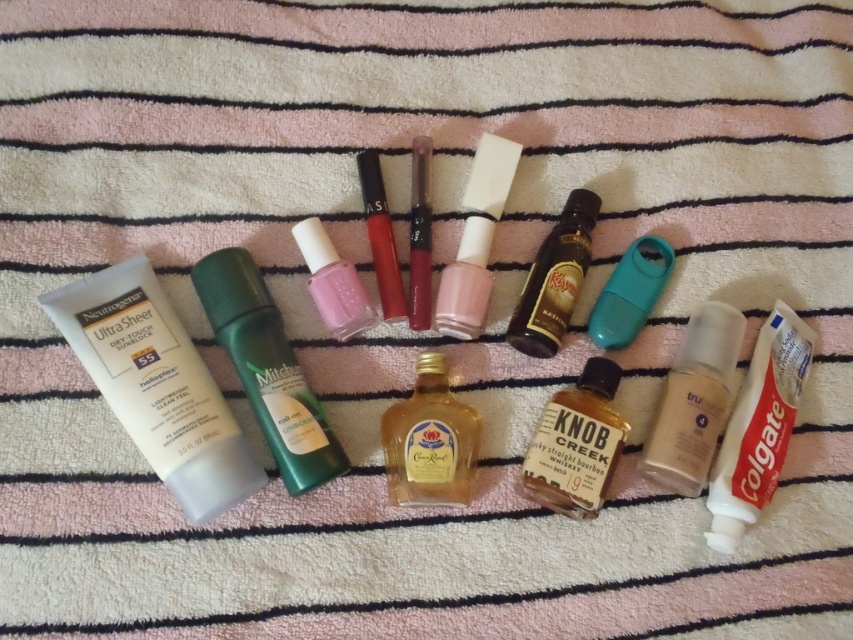
Question: Can you confirm if white matte tube at left is positioned to the right of green matte lotion at center?

Choices:
 (A) no
 (B) yes

Answer: (A)

Question: Can you confirm if matte plastic nail polish at center is positioned below shiny red lipstick at center?

Choices:
 (A) no
 (B) yes

Answer: (B)

Question: Among these points, which one is nearest to the camera?

Choices:
 (A) (589, 502)
 (B) (469, 186)
 (C) (694, 413)

Answer: (A)

Question: Does shiny dark brown bottle at center appear on the right side of matte pink nail polish at center?

Choices:
 (A) no
 (B) yes

Answer: (B)

Question: Which of the following is the farthest from the observer?

Choices:
 (A) gold glass bottle at center
 (B) matte pink nail polish at center
 (C) shiny metallic lipstick at center
 (D) white matte toothpaste at lower right

Answer: (C)

Question: Which point is closer to the camera taking this photo?

Choices:
 (A) (590, 204)
 (B) (665, 442)
 (C) (502, 145)
 (D) (350, 296)

Answer: (B)